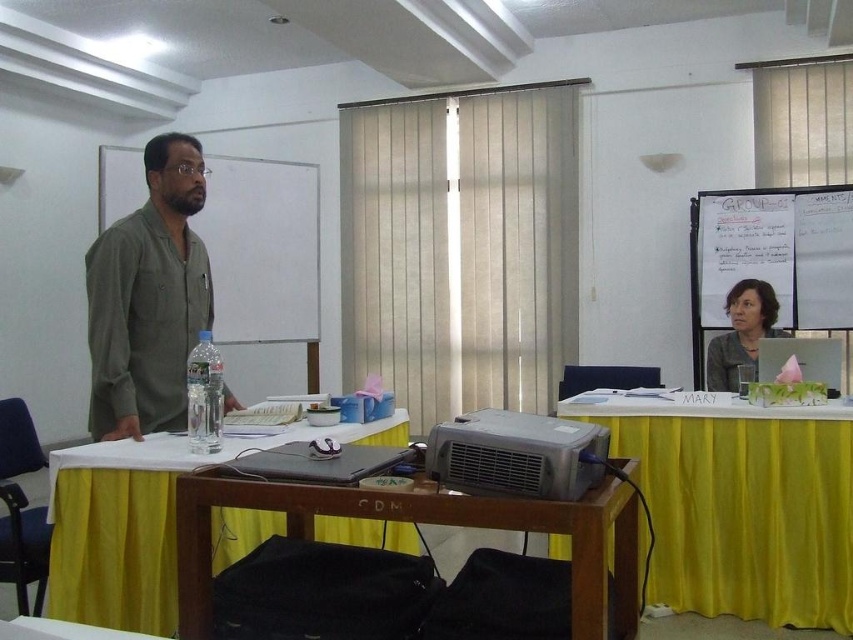
You are an attendee in the classroom and want to see both the green matte shirt at left and the silver metallic projector at center clearly. Which one appears larger in size?

The green matte shirt at left appears larger in size than the silver metallic projector at center.

You are a person who is 1.8 meters tall. You are standing next to the green matte shirt at left and want to reach the silver metallic projector at center. Can you comfortably stretch out your arm to touch it without moving your feet?

The distance between the green matte shirt at left and the silver metallic projector at center is 1.16 meters. Since the average arm length for a person of your height is around 0.7 to 0.8 meters, you would not be able to comfortably reach the silver metallic projector at center without moving your feet.